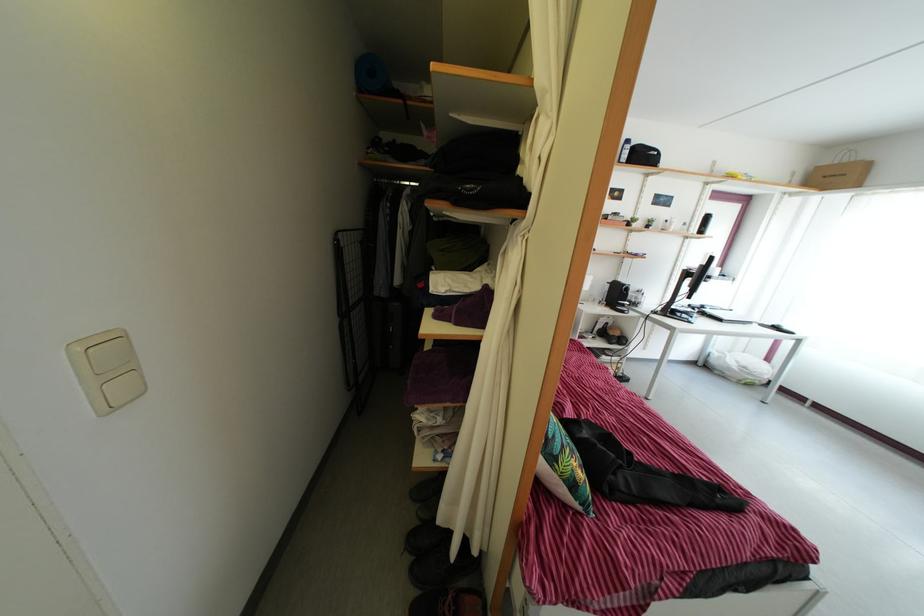
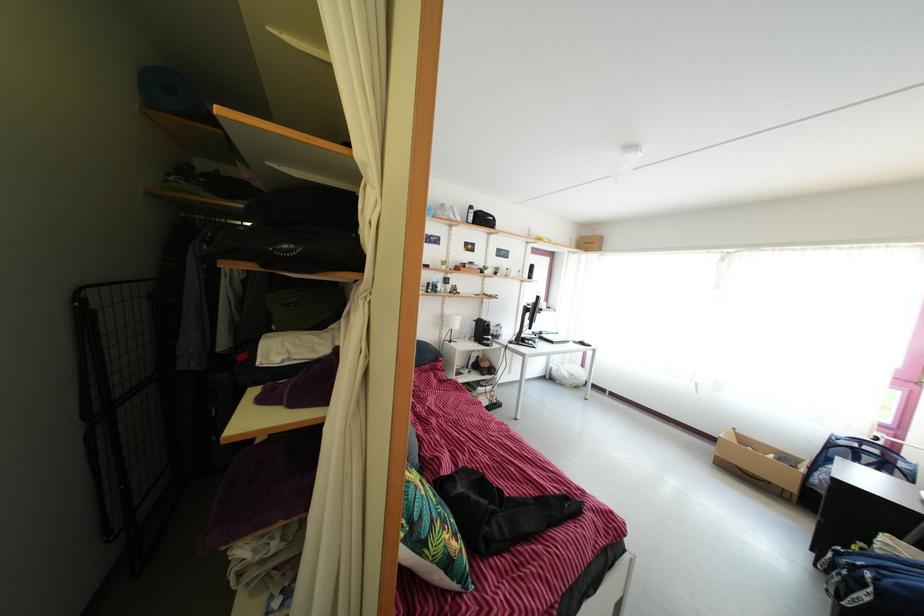
Where in the second image is the point corresponding to point 624,304 from the first image?

(489, 339)